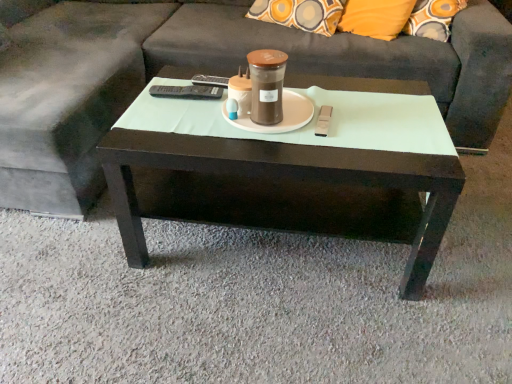
The height and width of the screenshot is (384, 512). I want to click on free space in front of white matte saucer at center, so click(274, 147).